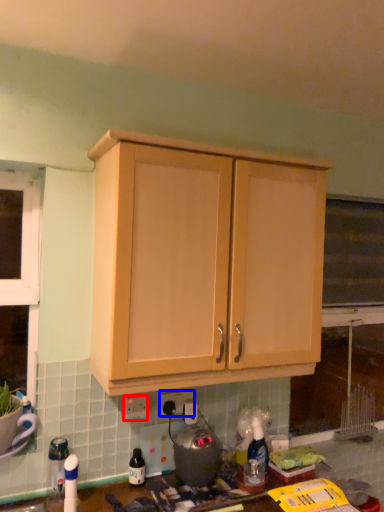
Question: Among these objects, which one is farthest to the camera, electric outlet (highlighted by a red box) or electric outlet (highlighted by a blue box)?

Choices:
 (A) electric outlet
 (B) electric outlet

Answer: (B)